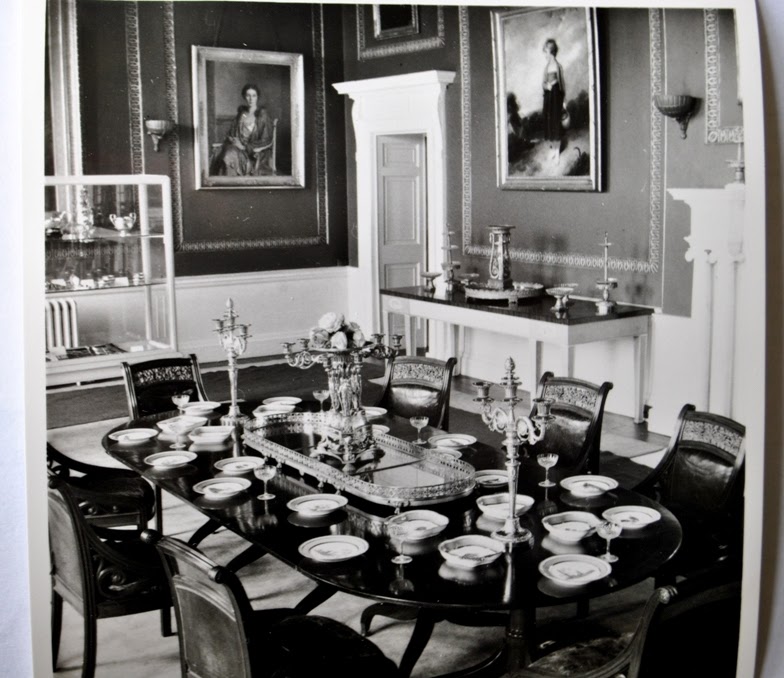
This screenshot has height=678, width=784. I want to click on picture, so click(542, 108), click(262, 108).